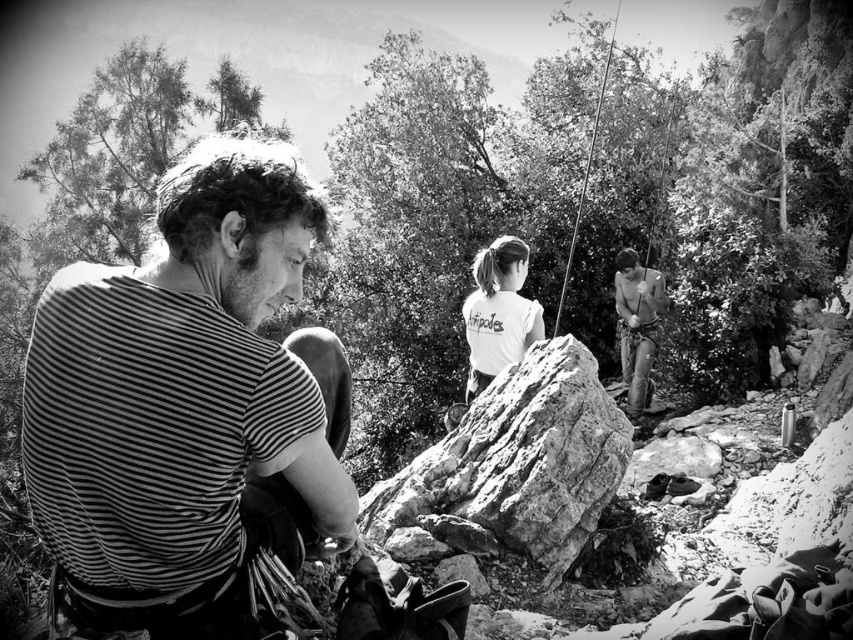
Which is above, striped fabric shirt at left or rough textured rock at center?

striped fabric shirt at left

Does striped fabric shirt at left lie in front of rough textured rock at center?

Yes, striped fabric shirt at left is closer to the viewer.

Which is behind, point (180, 440) or point (541, 541)?

Positioned behind is point (541, 541).

This screenshot has height=640, width=853. What are the coordinates of `striped fabric shirt at left` in the screenshot? It's located at (189, 403).

Is white cotton shirt at center shorter than shiny metallic harness at center?

Yes, white cotton shirt at center is shorter than shiny metallic harness at center.

The image size is (853, 640). Describe the element at coordinates (498, 310) in the screenshot. I see `white cotton shirt at center` at that location.

Identify the location of white cotton shirt at center. (498, 310).

Can you confirm if striped fabric shirt at left is thinner than white cotton shirt at center?

No.

Can you confirm if striped fabric shirt at left is taller than white cotton shirt at center?

Correct, striped fabric shirt at left is much taller as white cotton shirt at center.

Who is more distant from viewer, (119, 573) or (515, 356)?

The point (515, 356) is more distant.

Find the location of `striped fabric shirt at left`. striped fabric shirt at left is located at coordinates (189, 403).